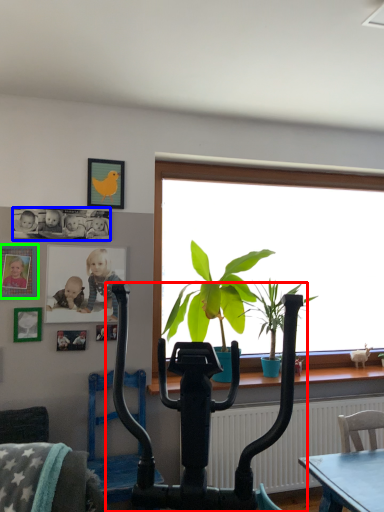
Question: Estimate the real-world distances between objects in this image. Which object is farther from vacuum (highlighted by a red box), art (highlighted by a blue box) or picture frame (highlighted by a green box)?

Choices:
 (A) art
 (B) picture frame

Answer: (A)